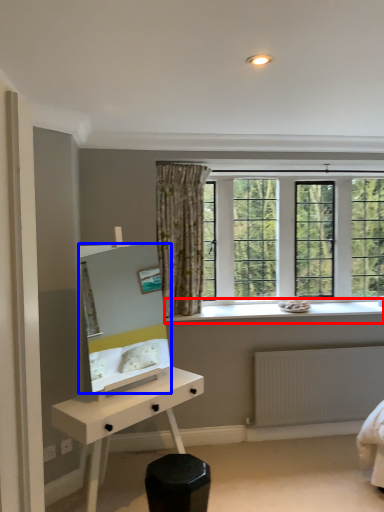
Question: Which object is further to the camera taking this photo, window sill (highlighted by a red box) or mirror (highlighted by a blue box)?

Choices:
 (A) window sill
 (B) mirror

Answer: (A)